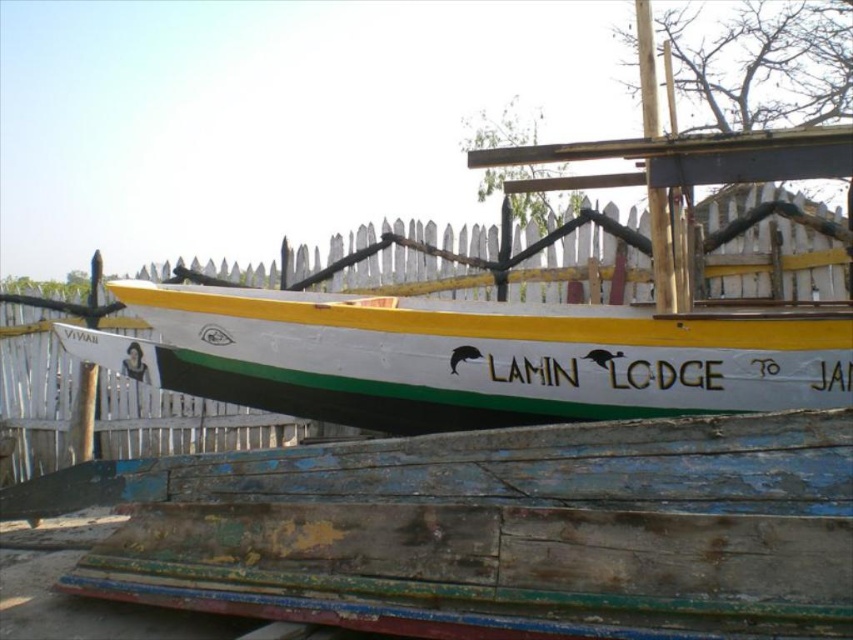
You are standing on the wooden platform and want to board the white painted wood boat at center. Based on its position, is it closer to the edge of the platform or the center?

The white painted wood boat at center is located at point coordinates that are nearly the center of the platform, so it is closer to the center of the platform rather than the edge.

You are standing on the dock and see the white painted wood boat at center and the white wooden fence at center. Which one is positioned to the right side?

The white painted wood boat at center is to the right of the white wooden fence at center, so the white painted wood boat at center is positioned to the right side.

You are a delivery person with a cart that is 2 meters wide. You need to move your cart between the white painted wood boat at center and the white wooden fence at center. Is there enough space for your cart to pass through?

The distance between the white painted wood boat at center and the white wooden fence at center is 2.54 meters. Since your cart is 2 meters wide, there is sufficient space for it to pass through.